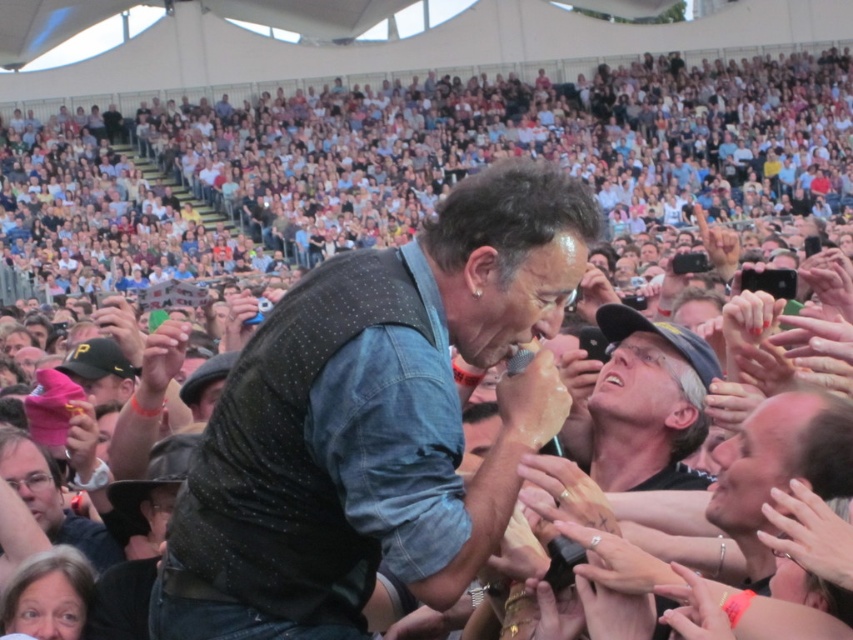
Does denim vest at center have a lesser width compared to gray fabric cap at center?

No, denim vest at center is not thinner than gray fabric cap at center.

Identify the location of denim vest at center. 375,420.